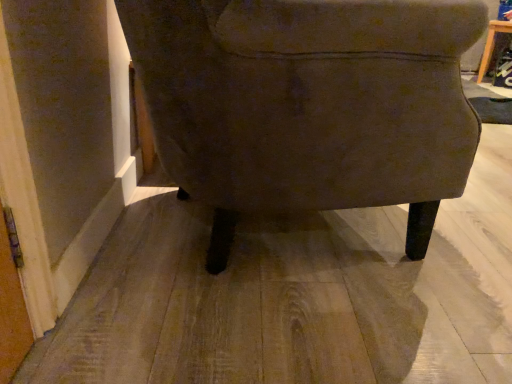
Question: Is wooden table at upper right situated inside matte brown fabric chair at center or outside?

Choices:
 (A) inside
 (B) outside

Answer: (B)

Question: Considering the positions of wooden table at upper right and matte brown fabric chair at center in the image, is wooden table at upper right taller or shorter than matte brown fabric chair at center?

Choices:
 (A) tall
 (B) short

Answer: (B)

Question: From the image's perspective, relative to matte brown fabric chair at center, is wooden table at upper right above or below?

Choices:
 (A) below
 (B) above

Answer: (B)

Question: From their relative heights in the image, would you say matte brown fabric chair at center is taller or shorter than wooden table at upper right?

Choices:
 (A) tall
 (B) short

Answer: (A)

Question: Relative to wooden table at upper right, is matte brown fabric chair at center in front or behind?

Choices:
 (A) front
 (B) behind

Answer: (A)

Question: Does point (342, 44) appear closer or farther from the camera than point (503, 26)?

Choices:
 (A) closer
 (B) farther

Answer: (A)

Question: Looking at the image, does matte brown fabric chair at center seem bigger or smaller compared to wooden table at upper right?

Choices:
 (A) big
 (B) small

Answer: (A)